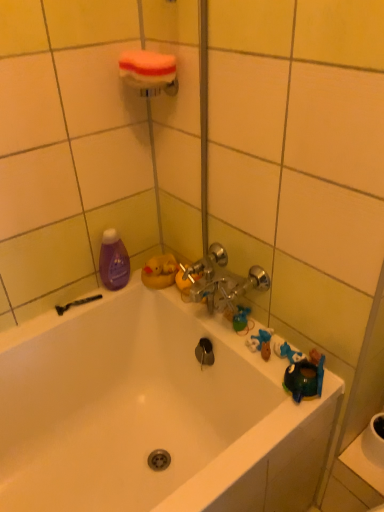
Question: Is white glossy bathtub at center positioned behind purple glossy bottle at left?

Choices:
 (A) no
 (B) yes

Answer: (A)

Question: Can you confirm if white glossy bathtub at center is shorter than purple glossy bottle at left?

Choices:
 (A) no
 (B) yes

Answer: (A)

Question: Is white glossy bathtub at center taller than purple glossy bottle at left?

Choices:
 (A) no
 (B) yes

Answer: (B)

Question: From the image's perspective, is white glossy bathtub at center beneath purple glossy bottle at left?

Choices:
 (A) no
 (B) yes

Answer: (B)

Question: Is white glossy bathtub at center oriented away from purple glossy bottle at left?

Choices:
 (A) yes
 (B) no

Answer: (B)

Question: In terms of height, does white glossy sink at lower right look taller or shorter compared to white foam sponge at upper center?

Choices:
 (A) short
 (B) tall

Answer: (A)

Question: From a real-world perspective, is white glossy sink at lower right physically located above or below white foam sponge at upper center?

Choices:
 (A) above
 (B) below

Answer: (B)

Question: Is white glossy sink at lower right in front of or behind white foam sponge at upper center in the image?

Choices:
 (A) behind
 (B) front

Answer: (A)

Question: Is white glossy sink at lower right inside or outside of white foam sponge at upper center?

Choices:
 (A) inside
 (B) outside

Answer: (B)

Question: Is white glossy bathtub at center inside or outside of white foam sponge at upper center?

Choices:
 (A) outside
 (B) inside

Answer: (A)

Question: Looking at their shapes, would you say white glossy bathtub at center is wider or thinner than white foam sponge at upper center?

Choices:
 (A) thin
 (B) wide

Answer: (B)

Question: Based on their sizes in the image, would you say white glossy bathtub at center is bigger or smaller than white foam sponge at upper center?

Choices:
 (A) big
 (B) small

Answer: (A)

Question: From a real-world perspective, is white glossy bathtub at center above or below white foam sponge at upper center?

Choices:
 (A) below
 (B) above

Answer: (A)

Question: From a real-world perspective, is white glossy sink at lower right physically located above or below purple glossy bottle at left?

Choices:
 (A) below
 (B) above

Answer: (A)

Question: From the image's perspective, is white glossy sink at lower right above or below purple glossy bottle at left?

Choices:
 (A) below
 (B) above

Answer: (A)